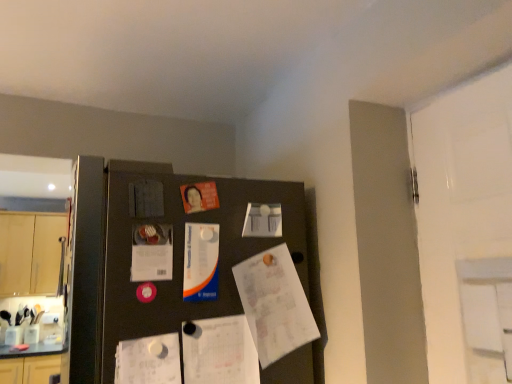
Question: Considering the positions of white glossy paper at upper center, the third poster when ordered from top to bottom, and white paper at center, arranged as the seventh poster when viewed from the top, in the image, is white glossy paper at upper center, the third poster when ordered from top to bottom, wider or thinner than white paper at center, arranged as the seventh poster when viewed from the top,?

Choices:
 (A) thin
 (B) wide

Answer: (B)

Question: Do you think white glossy paper at upper center, the third poster when ordered from top to bottom, is within white paper at center, arranged as the seventh poster when viewed from the top, or outside of it?

Choices:
 (A) outside
 (B) inside

Answer: (A)

Question: Which object is the closest to the white paper at lower left, the 2th poster from the bottom?

Choices:
 (A) blue glossy poster at center, the 5th poster viewed from the top
 (B) white glossy paper at upper center, the third poster when ordered from top to bottom
 (C) metallic silver poster at center, positioned as the 6th poster in bottom-to-top order
 (D) black matte fridge at center
 (E) light wood cabinet at left

Answer: (A)

Question: Estimate the real-world distances between objects in this image. Which object is farther from the white paper at center, the first poster when ordered from bottom to top?

Choices:
 (A) matte paper poster at center-left, the 4th poster positioned from the top
 (B) light wood cabinet at left
 (C) black matte fridge at center
 (D) white glossy paper at upper center, which ranks as the 5th poster in bottom-to-top order
 (E) metallic silver poster at center, the 2th poster when ordered from top to bottom

Answer: (B)